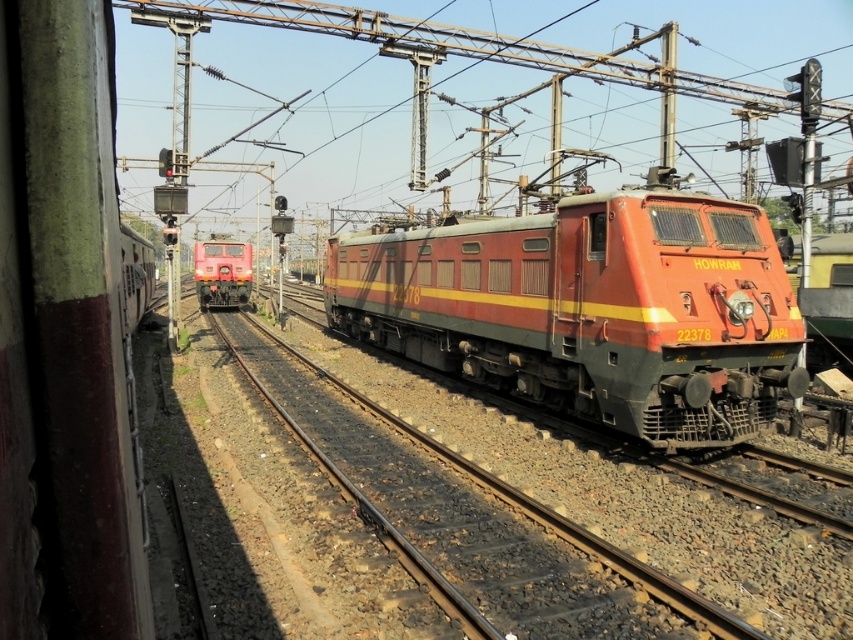
You are a railway engineer assessing the dimensions of the two locomotives in the image. Which of the two, the matte red locomotive at center or the matte red train at center, is taller?

The matte red locomotive at center is taller than the matte red train at center.

You are a railway engineer inspecting the tracks. You notice a specific point at coordinates (590,308). Which locomotive does this point belong to?

The point at coordinates (590,308) is on the matte red locomotive at center.